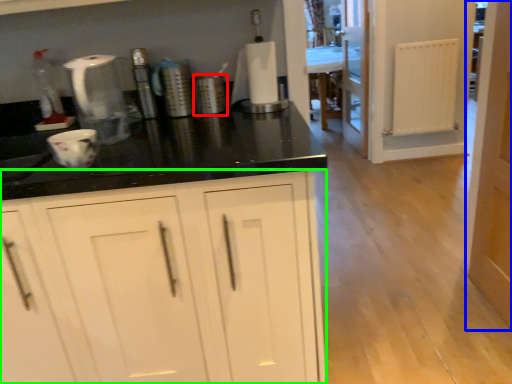
Question: Which is nearer to the appliance (highlighted by a red box)? door (highlighted by a blue box) or cabinetry (highlighted by a green box).

Choices:
 (A) door
 (B) cabinetry

Answer: (B)